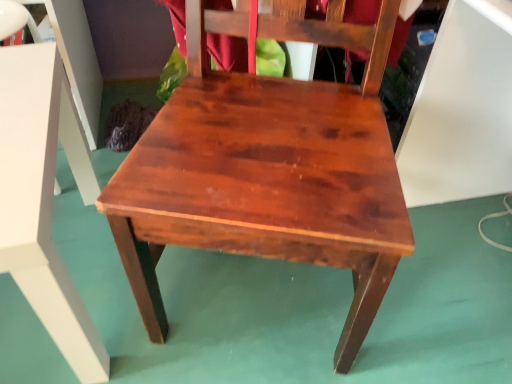
Question: Is satin wood chair at center next to wooden table at center and touching it?

Choices:
 (A) yes
 (B) no

Answer: (B)

Question: Is satin wood chair at center bigger than wooden table at center?

Choices:
 (A) no
 (B) yes

Answer: (B)

Question: Could you tell me if satin wood chair at center is turned towards wooden table at center?

Choices:
 (A) no
 (B) yes

Answer: (A)

Question: Is satin wood chair at center surrounding wooden table at center?

Choices:
 (A) yes
 (B) no

Answer: (B)

Question: Does satin wood chair at center have a smaller size compared to wooden table at center?

Choices:
 (A) yes
 (B) no

Answer: (B)

Question: From the image's perspective, is satin wood chair at center under wooden table at center?

Choices:
 (A) no
 (B) yes

Answer: (A)

Question: Can you confirm if wooden table at center is wider than satin wood chair at center?

Choices:
 (A) no
 (B) yes

Answer: (A)

Question: Does wooden table at center have a greater height compared to satin wood chair at center?

Choices:
 (A) no
 (B) yes

Answer: (A)

Question: Is satin wood chair at center surrounded by wooden table at center?

Choices:
 (A) no
 (B) yes

Answer: (A)

Question: Is wooden table at center further to the viewer compared to satin wood chair at center?

Choices:
 (A) yes
 (B) no

Answer: (A)

Question: From a real-world perspective, is wooden table at center located beneath satin wood chair at center?

Choices:
 (A) no
 (B) yes

Answer: (B)

Question: Can you confirm if wooden table at center is smaller than satin wood chair at center?

Choices:
 (A) no
 (B) yes

Answer: (B)

Question: Is satin wood chair at center in front of or behind wooden table at center in the image?

Choices:
 (A) behind
 (B) front

Answer: (B)